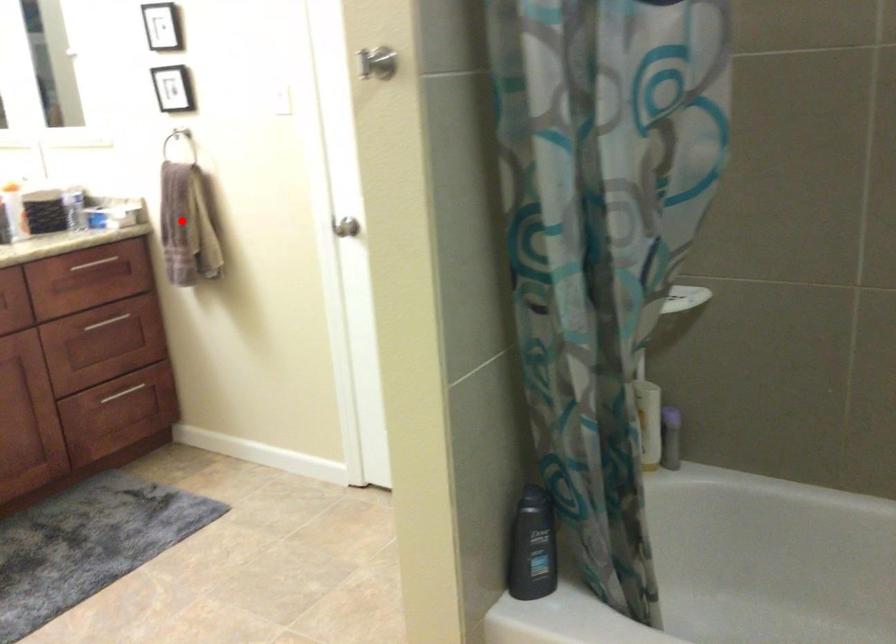
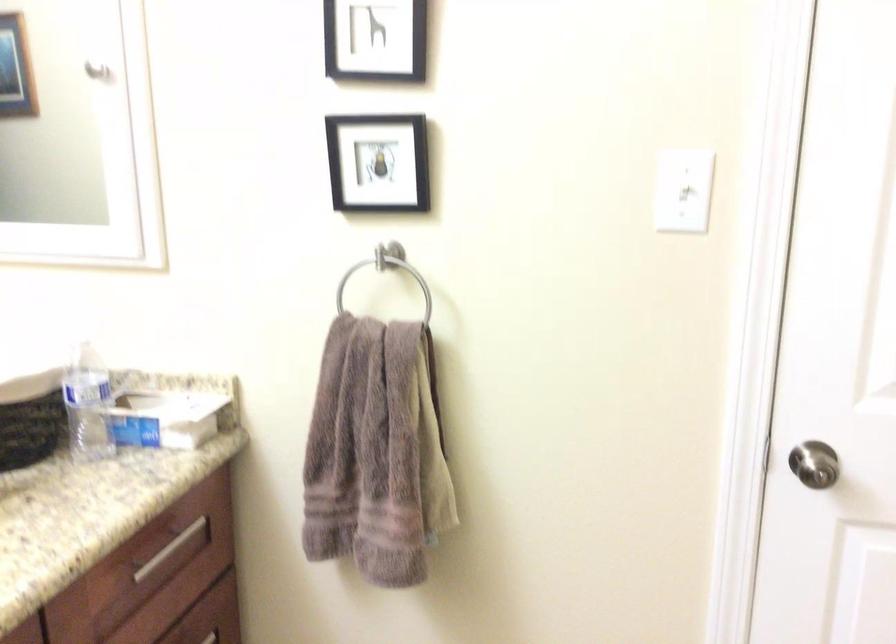
Where in the second image is the point corresponding to the highlighted location from the first image?

(375, 453)